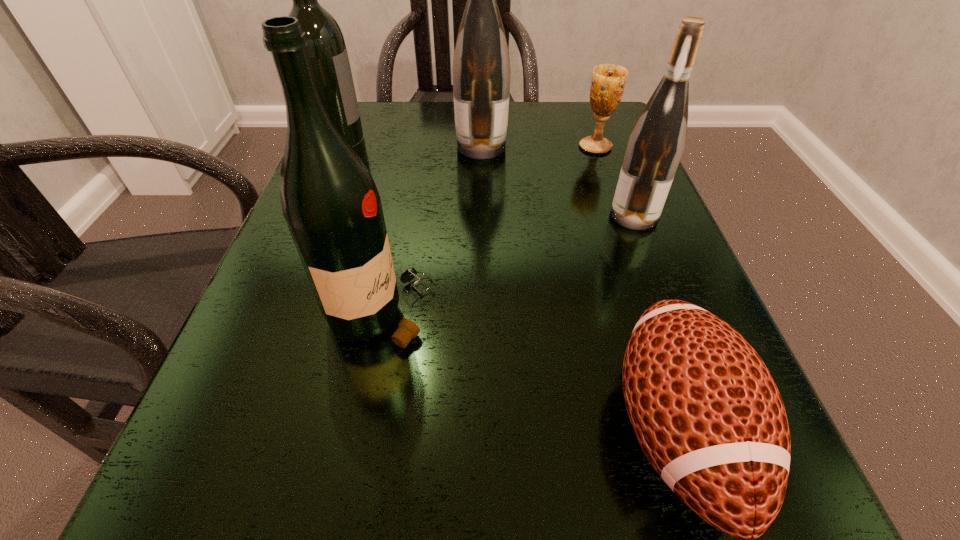
Find the location of `free point at the left edge`. free point at the left edge is located at coordinates (253, 358).

Image resolution: width=960 pixels, height=540 pixels. What are the coordinates of `vacant space at the right edge of the desktop` in the screenshot? It's located at (594, 158).

This screenshot has height=540, width=960. In the image, there is a desktop. In order to click on vacant space at the far left corner in this screenshot , I will do `click(372, 113)`.

Locate an element on the screen. The height and width of the screenshot is (540, 960). free space between the second wine bottle from right to left and the chalice is located at coordinates (539, 147).

At what (x,y) coordinates should I click in order to perform the action: click on vacant space in between the fourth object from right to left and the second object from left to right. Please return your answer as a coordinate pair (x, y). The image size is (960, 540). Looking at the image, I should click on (431, 229).

What are the coordinates of `vacant space that's between the leftmost wine bottle and the second wine bottle from right to left` in the screenshot? It's located at (413, 155).

You are a GUI agent. You are given a task and a screenshot of the screen. Output one action in this format:
    pyautogui.click(x=<x>, y=<y>)
    Task: Click on the free spot between the chalice and the fourth object from right to left
    The width and height of the screenshot is (960, 540).
    Given the screenshot: What is the action you would take?
    pyautogui.click(x=539, y=147)

Locate an element on the screen. This screenshot has width=960, height=540. free spot between the third object from left to right and the chalice is located at coordinates click(539, 147).

Image resolution: width=960 pixels, height=540 pixels. Identify the location of free space between the second wine bottle from right to left and the third nearest object. (558, 181).

Locate which object is the closest to the second wine bottle from right to left. Please provide its 2D coordinates. Your answer should be formatted as a tuple, i.e. [(x, y)], where the tuple contains the x and y coordinates of a point satisfying the conditions above.

[(608, 82)]